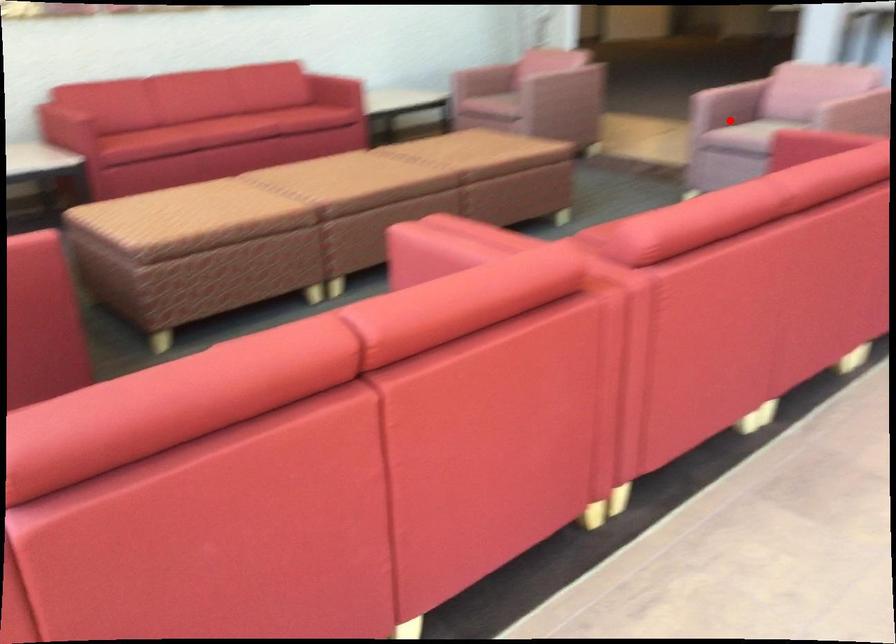
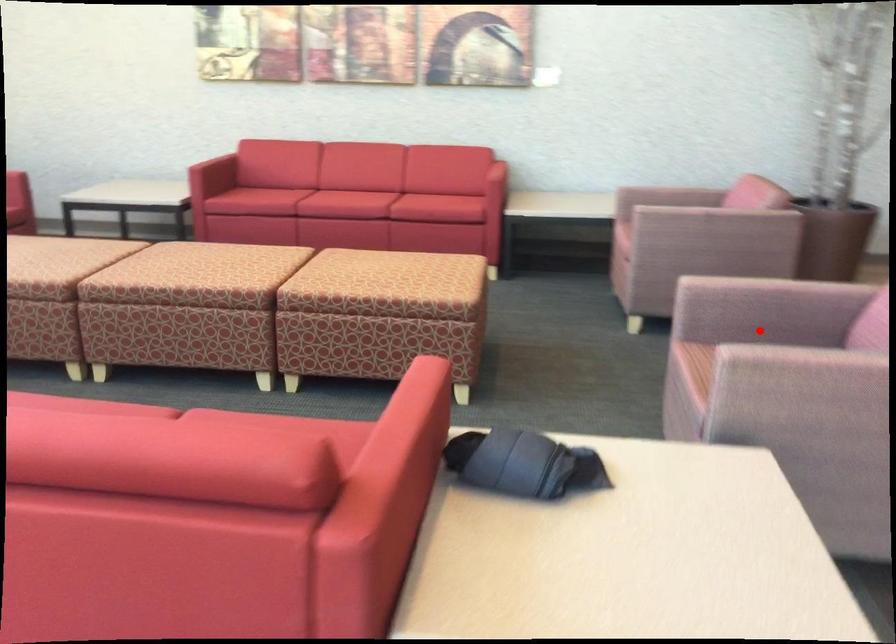
I am providing you with two images of the same scene from different viewpoints. A red point is marked on the first image and another point is marked on the second image. Is the red point in image1 aligned with the point shown in image2?

Yes